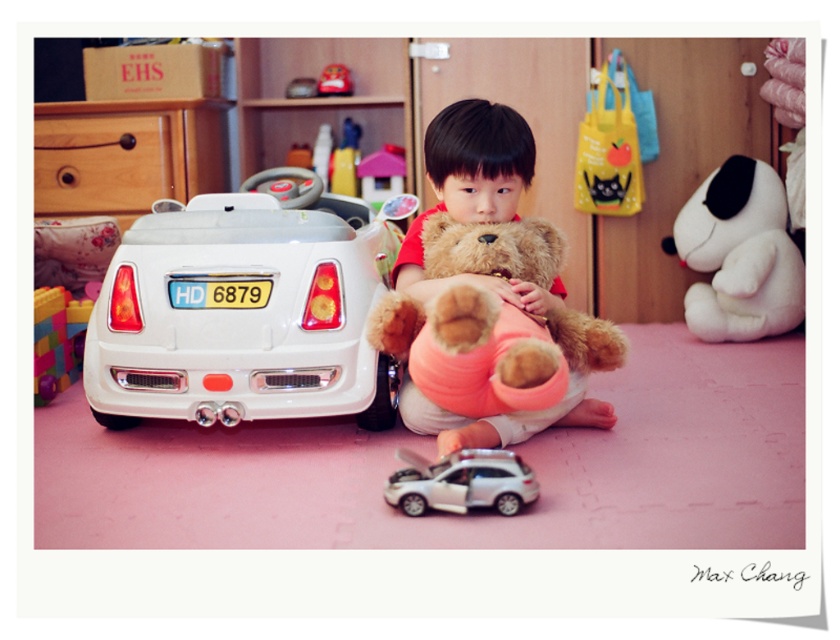
Can you confirm if white matte toy car at left is taller than brown plush teddy bear at center?

Yes.

Which is more to the right, white matte toy car at left or brown plush teddy bear at center?

From the viewer's perspective, brown plush teddy bear at center appears more on the right side.

The image size is (840, 640). I want to click on white matte toy car at left, so 244,312.

Locate an element on the screen. This screenshot has height=640, width=840. white matte toy car at left is located at coordinates (244, 312).

Can you confirm if white matte toy car at left is thinner than silver metallic toy car at center?

No, white matte toy car at left is not thinner than silver metallic toy car at center.

Does white matte toy car at left have a lesser height compared to silver metallic toy car at center?

No.

Which is in front, point (235, 221) or point (450, 500)?

Point (450, 500)

At what (x,y) coordinates should I click in order to perform the action: click on white matte toy car at left. Please return your answer as a coordinate pair (x, y). This screenshot has height=640, width=840. Looking at the image, I should click on (244, 312).

Describe the element at coordinates (244, 312) in the screenshot. The image size is (840, 640). I see `white matte toy car at left` at that location.

Is white matte toy car at left smaller than multicolored plastic blocks at left?

No, white matte toy car at left is not smaller than multicolored plastic blocks at left.

Between point (126, 312) and point (72, 364), which one is positioned behind?

The point (72, 364) is more distant.

Where is `white matte toy car at left`? white matte toy car at left is located at coordinates (244, 312).